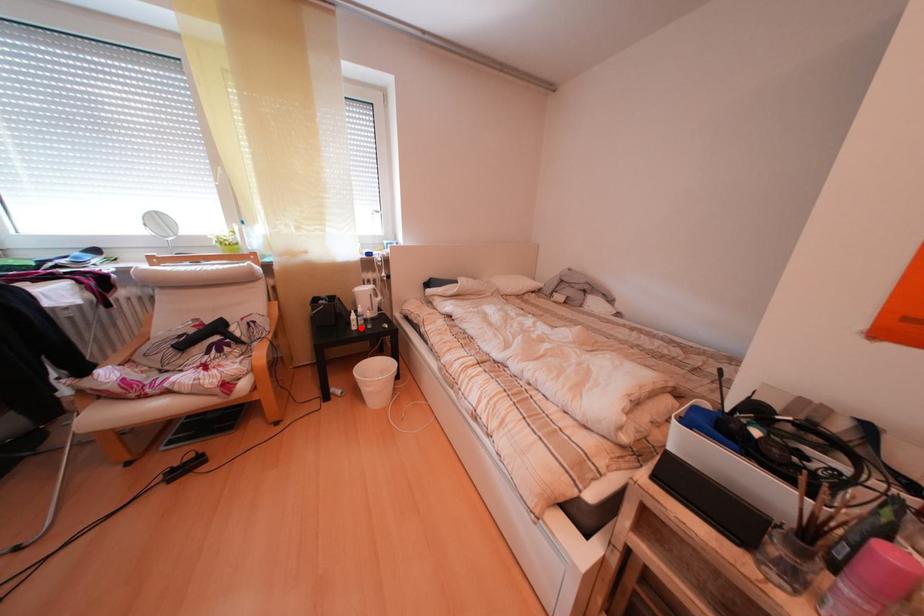
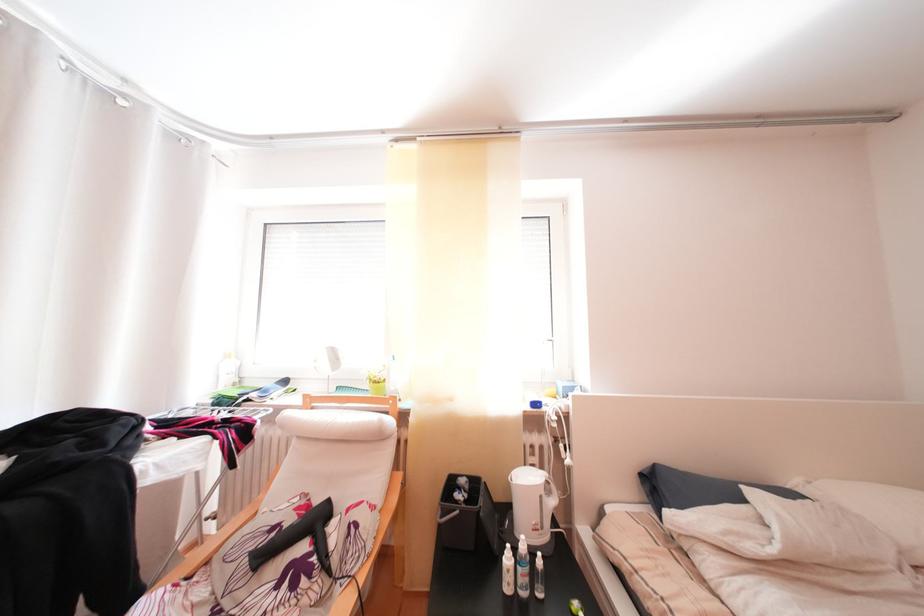
Find the pixel in the second image that matches the highlighted location in the first image.

(509, 565)